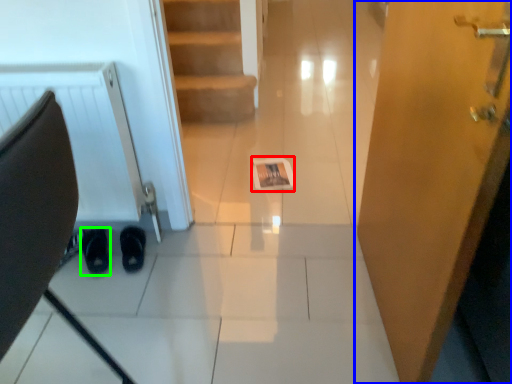
Question: Based on their relative distances, which object is farther from magazine (highlighted by a red box)? Choose from door (highlighted by a blue box) and footwear (highlighted by a green box).

Choices:
 (A) door
 (B) footwear

Answer: (A)